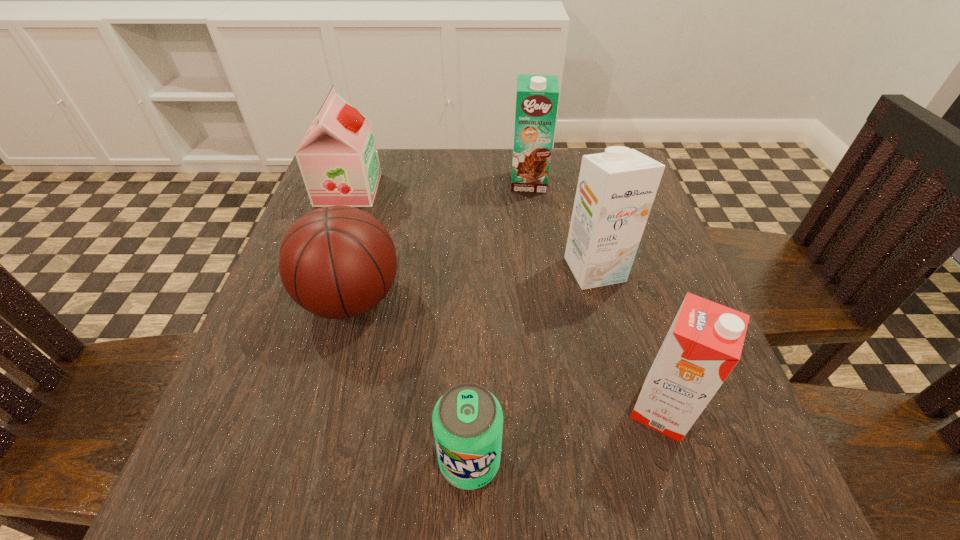
Locate an element on the screen. The width and height of the screenshot is (960, 540). free location located with the cap open on the soya milk is located at coordinates (481, 190).

At what (x,y) coordinates should I click in order to perform the action: click on vacant area located on the left of the shortest carton. Please return your answer as a coordinate pair (x, y). Image resolution: width=960 pixels, height=540 pixels. Looking at the image, I should click on (448, 410).

Locate an element on the screen. The height and width of the screenshot is (540, 960). vacant space located 0.090m on the back of the basketball is located at coordinates (369, 234).

The width and height of the screenshot is (960, 540). Identify the location of carton located in the far edge section of the desktop. (537, 96).

Locate an element on the screen. This screenshot has height=540, width=960. soya milk that is at the far edge is located at coordinates (338, 159).

Locate an element on the screen. object located in the near edge section of the desktop is located at coordinates (467, 420).

Where is `soya milk positioned at the left edge`? soya milk positioned at the left edge is located at coordinates (338, 159).

Locate an element on the screen. This screenshot has height=540, width=960. basketball at the left edge is located at coordinates (336, 262).

You are a GUI agent. You are given a task and a screenshot of the screen. Output one action in this format:
    pyautogui.click(x=<x>, y=<y>)
    Task: Click on the object that is at the far left corner
    This screenshot has width=960, height=540.
    Given the screenshot: What is the action you would take?
    pyautogui.click(x=338, y=159)

This screenshot has height=540, width=960. In the image, there is a desktop. In order to click on vacant space at the far edge in this screenshot , I will do `click(444, 151)`.